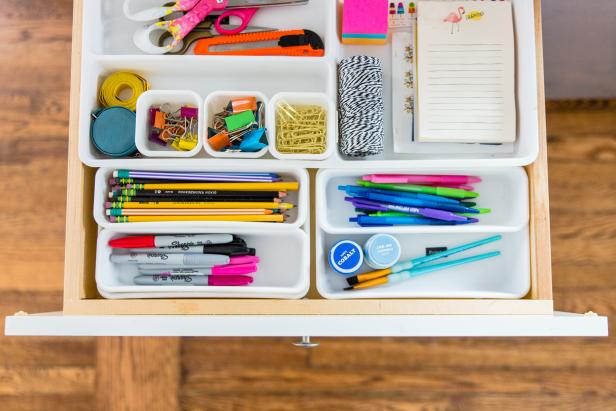
Locate an element on the screen. The width and height of the screenshot is (616, 411). pens is located at coordinates (379, 218), (387, 214), (421, 210), (429, 201), (440, 196), (448, 194), (466, 184), (460, 177).